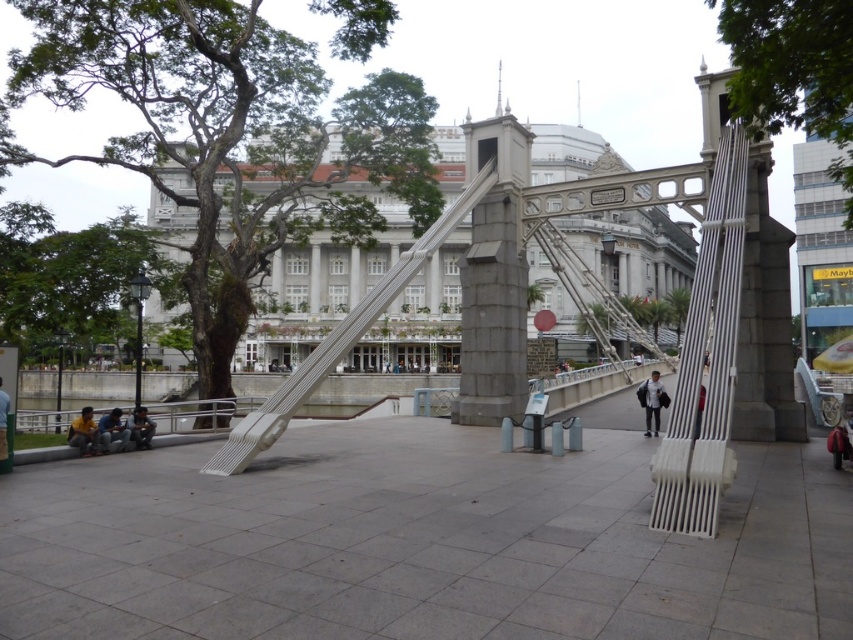
You are standing at the point labeled as point (653, 401) in the image. What object is directly beneath your feet?

The point (653, 401) is on white matte jacket at center, so the object directly beneath your feet is the white matte jacket at center.

You are a photographer standing at the lower left of the scene. You want to take a photo of the classical building in the background. The dark blue jeans at lower left and the matte white bench at center are blocking your view. Which object is taller and might block your view more?

The dark blue jeans at lower left is taller than the matte white bench at center, so it might block your view more.